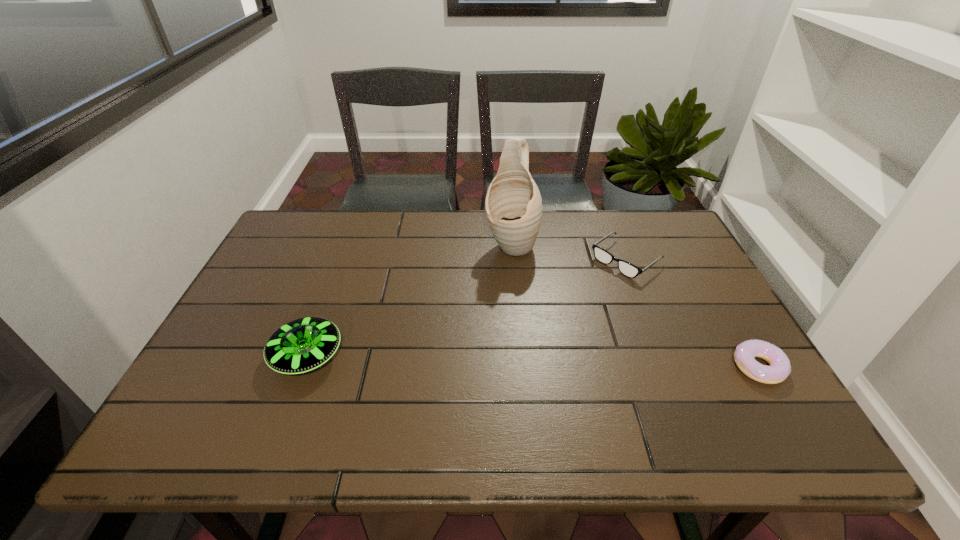
Identify the location of object that can be found as the third closest to the second object from right to left. The image size is (960, 540). (302, 345).

Locate an element on the screen. the third closest object to the tallest object is located at coordinates (745, 353).

At what (x,y) coordinates should I click in order to perform the action: click on free space that satisfies the following two spatial constraints: 1. on the front side of the tallest object; 2. on the left side of the third object from left to right. Please return your answer as a coordinate pair (x, y). Looking at the image, I should click on (513, 259).

This screenshot has width=960, height=540. Identify the location of vacant space that satisfies the following two spatial constraints: 1. on the front side of the second object from left to right; 2. on the left side of the spectacles. pos(513,259).

At what (x,y) coordinates should I click in order to perform the action: click on vacant area that satisfies the following two spatial constraints: 1. on the front side of the pitcher; 2. on the left side of the doughnut. Please return your answer as a coordinate pair (x, y). Looking at the image, I should click on [x=521, y=367].